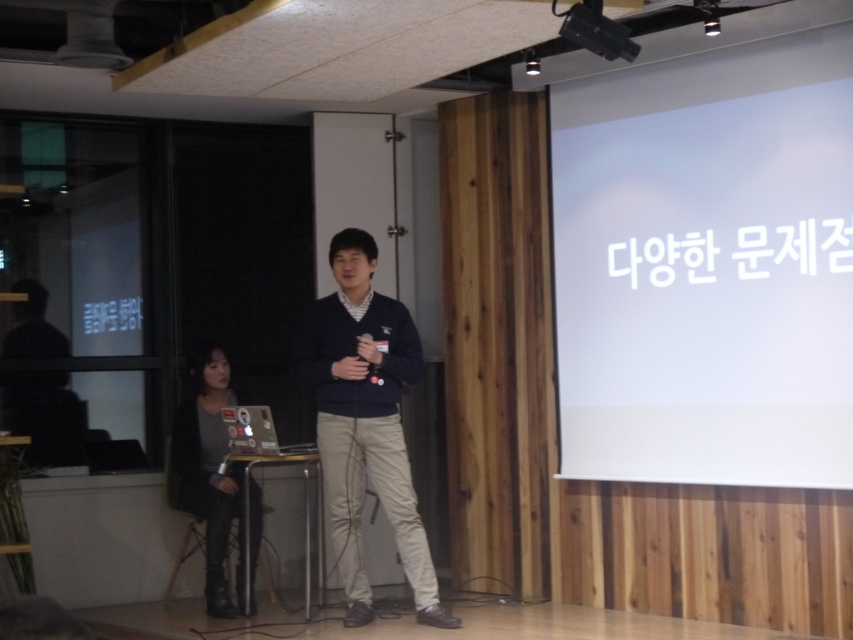
Is the position of white matte projection screen at upper right more distant than that of gray fabric jacket at lower left?

No.

Where is `white matte projection screen at upper right`? This screenshot has width=853, height=640. white matte projection screen at upper right is located at coordinates (706, 268).

The image size is (853, 640). What do you see at coordinates (706, 268) in the screenshot?
I see `white matte projection screen at upper right` at bounding box center [706, 268].

Image resolution: width=853 pixels, height=640 pixels. I want to click on white matte projection screen at upper right, so click(x=706, y=268).

Can you confirm if white matte projection screen at upper right is bigger than black plastic projector at upper center?

Yes.

Which is above, white matte projection screen at upper right or black plastic projector at upper center?

Positioned higher is black plastic projector at upper center.

Who is more forward, (611, 282) or (573, 26)?

Point (573, 26)

Locate an element on the screen. white matte projection screen at upper right is located at coordinates 706,268.

Does point (222, 522) lie in front of point (595, 42)?

No, (222, 522) is behind (595, 42).

Between gray fabric jacket at lower left and black plastic projector at upper center, which one appears on the right side from the viewer's perspective?

Positioned to the right is black plastic projector at upper center.

The image size is (853, 640). What do you see at coordinates (207, 465) in the screenshot?
I see `gray fabric jacket at lower left` at bounding box center [207, 465].

Identify the location of gray fabric jacket at lower left. (207, 465).